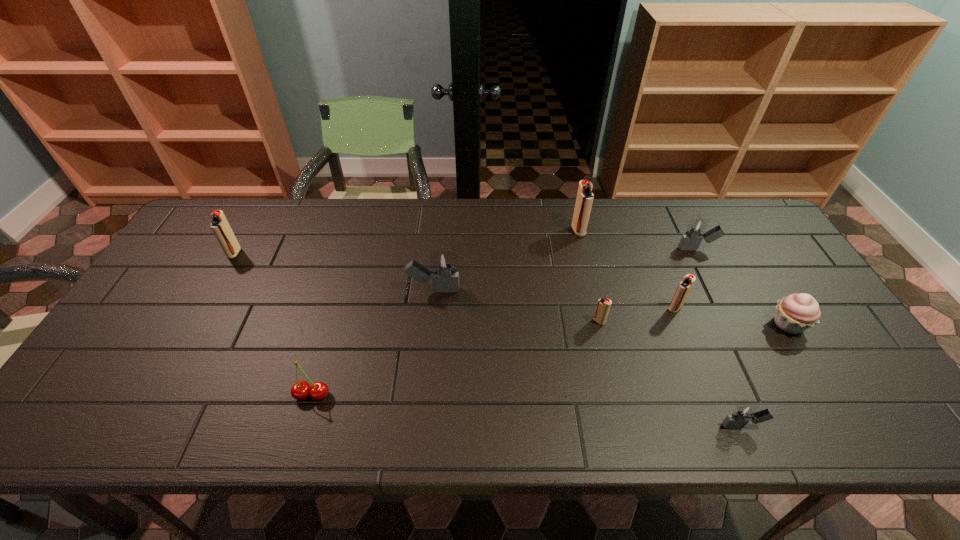
Where is `the biggest red igniter`? The height and width of the screenshot is (540, 960). the biggest red igniter is located at coordinates (585, 197).

At what (x,y) coordinates should I click in order to perform the action: click on the farthest red igniter. Please return your answer as a coordinate pair (x, y). This screenshot has height=540, width=960. Looking at the image, I should click on [x=585, y=197].

You are a GUI agent. You are given a task and a screenshot of the screen. Output one action in this format:
    pyautogui.click(x=<x>, y=<y>)
    Task: Click on the leftmost object
    This screenshot has width=960, height=540.
    Given the screenshot: What is the action you would take?
    pyautogui.click(x=219, y=224)

Where is `the second biggest red igniter`? the second biggest red igniter is located at coordinates (219, 224).

Locate an element on the screen. This screenshot has height=540, width=960. the fourth nearest igniter is located at coordinates (446, 280).

This screenshot has height=540, width=960. Find the location of `the leftmost gray igniter`. the leftmost gray igniter is located at coordinates (446, 280).

Where is `the farthest gray igniter`? This screenshot has height=540, width=960. the farthest gray igniter is located at coordinates (695, 230).

Locate an element on the screen. the rightmost red igniter is located at coordinates (685, 286).

At what (x,y) coordinates should I click in order to perform the action: click on the second nearest red igniter. Please return your answer as a coordinate pair (x, y). Looking at the image, I should click on (685, 286).

This screenshot has width=960, height=540. What are the coordinates of `the rightmost object` in the screenshot? It's located at (795, 313).